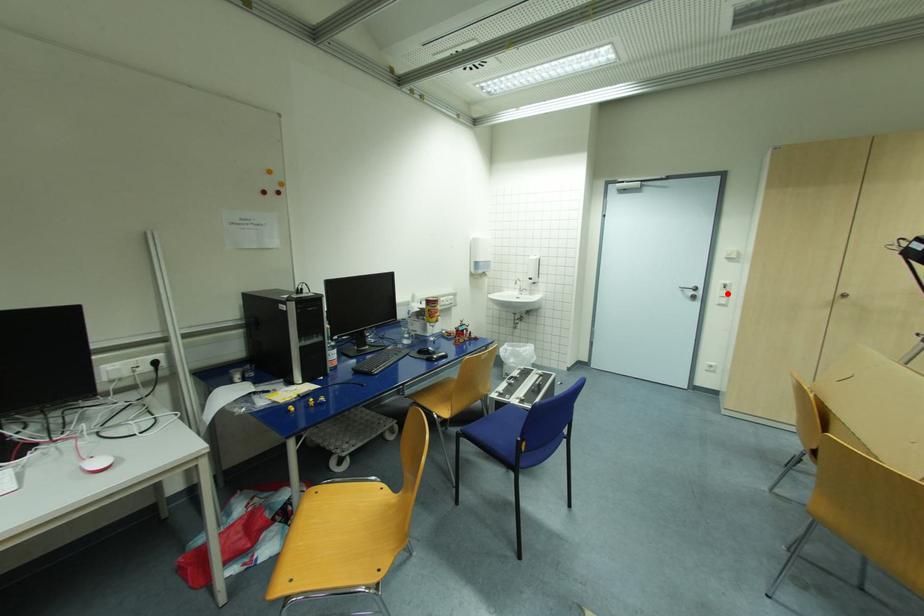
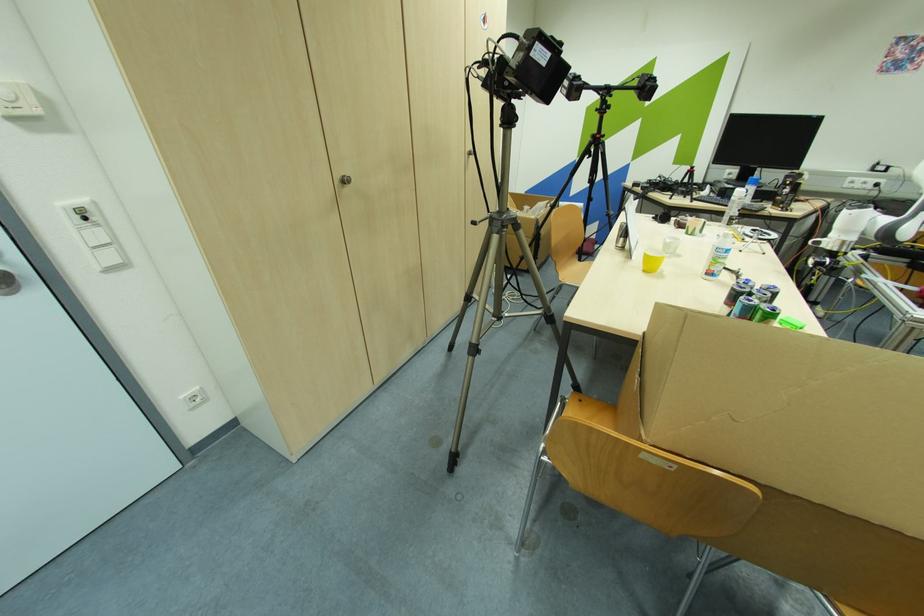
In the second image, find the point that corresponds to the highlighted location in the first image.

(102, 236)